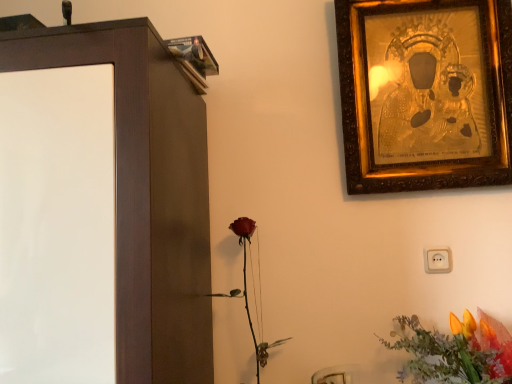
Question: Is gold textured picture frame at upper right thinner than matte red rose at center?

Choices:
 (A) yes
 (B) no

Answer: (A)

Question: Is matte red rose at center inside gold textured picture frame at upper right?

Choices:
 (A) yes
 (B) no

Answer: (B)

Question: Is gold textured picture frame at upper right far away from matte red rose at center?

Choices:
 (A) no
 (B) yes

Answer: (A)

Question: Considering the relative sizes of gold textured picture frame at upper right and matte red rose at center in the image provided, is gold textured picture frame at upper right taller than matte red rose at center?

Choices:
 (A) yes
 (B) no

Answer: (A)

Question: Is gold textured picture frame at upper right positioned in front of matte red rose at center?

Choices:
 (A) yes
 (B) no

Answer: (B)

Question: From a real-world perspective, is matte red rose at center above or below matte brown cabinet at left?

Choices:
 (A) above
 (B) below

Answer: (B)

Question: Is point (254, 342) positioned closer to the camera than point (199, 382)?

Choices:
 (A) farther
 (B) closer

Answer: (A)

Question: In terms of width, does matte red rose at center look wider or thinner when compared to matte brown cabinet at left?

Choices:
 (A) wide
 (B) thin

Answer: (B)

Question: Based on their positions, is matte red rose at center located to the left or right of matte brown cabinet at left?

Choices:
 (A) right
 (B) left

Answer: (A)

Question: Is point (264, 362) positioned closer to the camera than point (452, 347)?

Choices:
 (A) closer
 (B) farther

Answer: (B)

Question: Would you say matte red rose at center is inside or outside vibrant orange petals at lower right?

Choices:
 (A) inside
 (B) outside

Answer: (B)

Question: Considering the positions of matte red rose at center and vibrant orange petals at lower right in the image, is matte red rose at center bigger or smaller than vibrant orange petals at lower right?

Choices:
 (A) small
 (B) big

Answer: (A)

Question: From the image's perspective, is matte red rose at center positioned above or below vibrant orange petals at lower right?

Choices:
 (A) above
 (B) below

Answer: (A)

Question: Relative to vibrant orange petals at lower right, is matte brown cabinet at left in front or behind?

Choices:
 (A) front
 (B) behind

Answer: (A)

Question: Is matte brown cabinet at left to the left or to the right of vibrant orange petals at lower right in the image?

Choices:
 (A) left
 (B) right

Answer: (A)